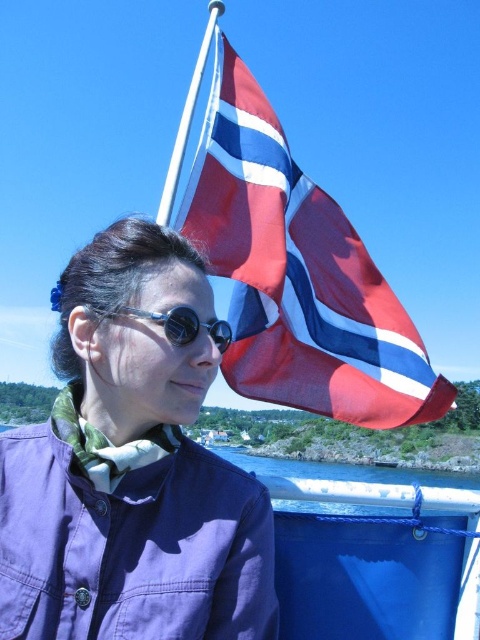
Question: Estimate the real-world distances between objects in this image. Which object is closer to the purple fabric jacket at upper left?

Choices:
 (A) red and white striped flag at upper right
 (B) black matte goggles at center

Answer: (B)

Question: Does red and white striped flag at upper right come behind black matte goggles at center?

Choices:
 (A) yes
 (B) no

Answer: (A)

Question: Which of the following is the closest to the observer?

Choices:
 (A) (69, 579)
 (B) (381, 385)
 (C) (216, 332)

Answer: (A)

Question: Which object is farther from the camera taking this photo?

Choices:
 (A) red and white striped flag at upper right
 (B) purple fabric jacket at upper left
 (C) black matte goggles at center

Answer: (A)

Question: Observing the image, what is the correct spatial positioning of red and white striped flag at upper right in reference to black matte goggles at center?

Choices:
 (A) below
 (B) above

Answer: (A)

Question: In this image, where is purple fabric jacket at upper left located relative to red and white striped flag at upper right?

Choices:
 (A) above
 (B) below

Answer: (A)